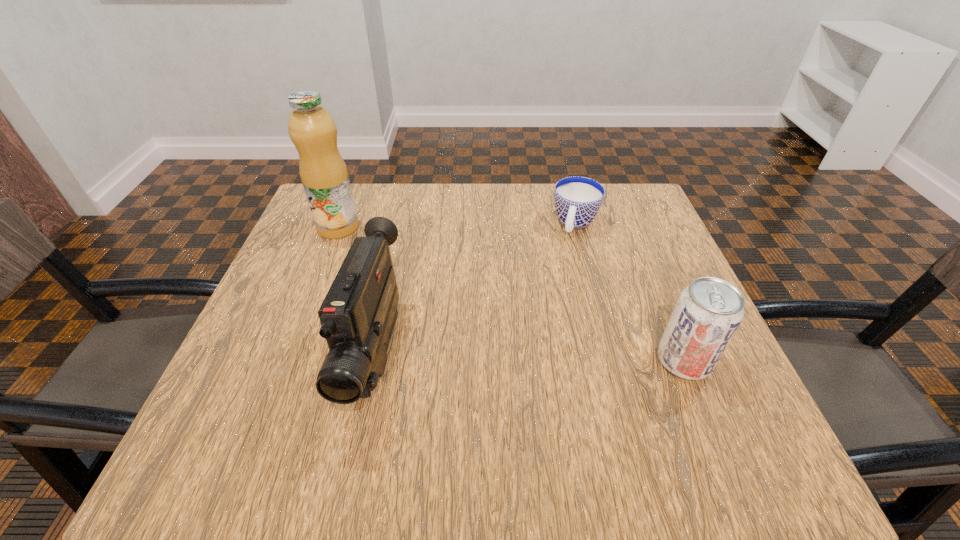
You are a GUI agent. You are given a task and a screenshot of the screen. Output one action in this format:
    pyautogui.click(x=<x>, y=<y>)
    Task: Click on the camcorder
    Image resolution: width=960 pixels, height=540 pixels.
    Given the screenshot: What is the action you would take?
    pyautogui.click(x=357, y=316)

Where is `the third shortest object`? This screenshot has height=540, width=960. the third shortest object is located at coordinates (357, 316).

Locate an element on the screen. soda can is located at coordinates (x=708, y=312).

Where is `the third tallest object`? the third tallest object is located at coordinates (708, 312).

I want to click on the second object from right to left, so click(577, 199).

Image resolution: width=960 pixels, height=540 pixels. I want to click on cup, so click(x=577, y=199).

Where is `the tallest object`? This screenshot has width=960, height=540. the tallest object is located at coordinates (324, 175).

At what (x,y) coordinates should I click in order to perform the action: click on fruit juice. Please return your answer as a coordinate pair (x, y). The image size is (960, 540). Looking at the image, I should click on (324, 175).

This screenshot has height=540, width=960. What are the coordinates of `blank space located on the back of the soda can` in the screenshot? It's located at (633, 237).

The width and height of the screenshot is (960, 540). What are the coordinates of `free space located 0.340m on the side of the second object from right to left with the handle` in the screenshot? It's located at (534, 347).